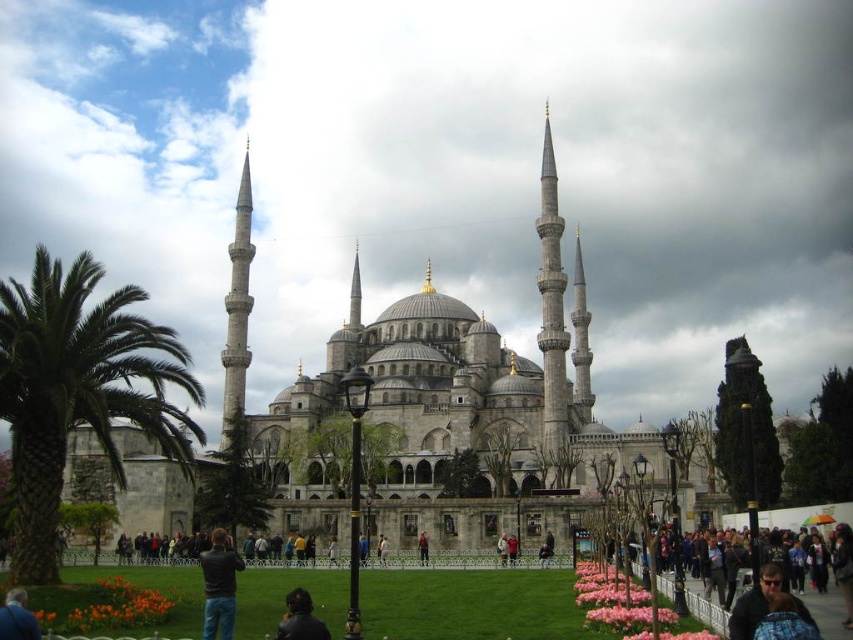
You are standing in front of the Blue Mosque in Istanbul and want to take a photo of the point at coordinates (213, 593). If you need to be at least 60 meters away to capture the entire structure in one frame, will you be able to do so from your current position?

Answer: The point at coordinates (213, 593) is 66.36 meters away from you. Since this distance is greater than the required 60 meters, you can indeed capture the entire Blue Mosque in one frame from your current position.

You are a photographer planning to capture a photo of the Blue Mosque with the crowd in the background. You notice two groups wearing dark blue jeans at lower left and dark blue jeans at center. Which group should you position closer to the camera to ensure they are in focus without blurring the background?

You should position the dark blue jeans at lower left closer to the camera because it is already over the dark blue jeans at center, making it naturally closer and easier to focus on while keeping the background blurred.

You are standing at the Blue Mosque and want to find a person wearing dark blue jacket at lower left and dark blue jeans at center. If you can walk 50 meters, can you reach both of them starting from your current position?

The dark blue jacket at lower left is 40.84 meters from dark blue jeans at center. Since you can walk 50 meters, you can reach both starting from your current position.